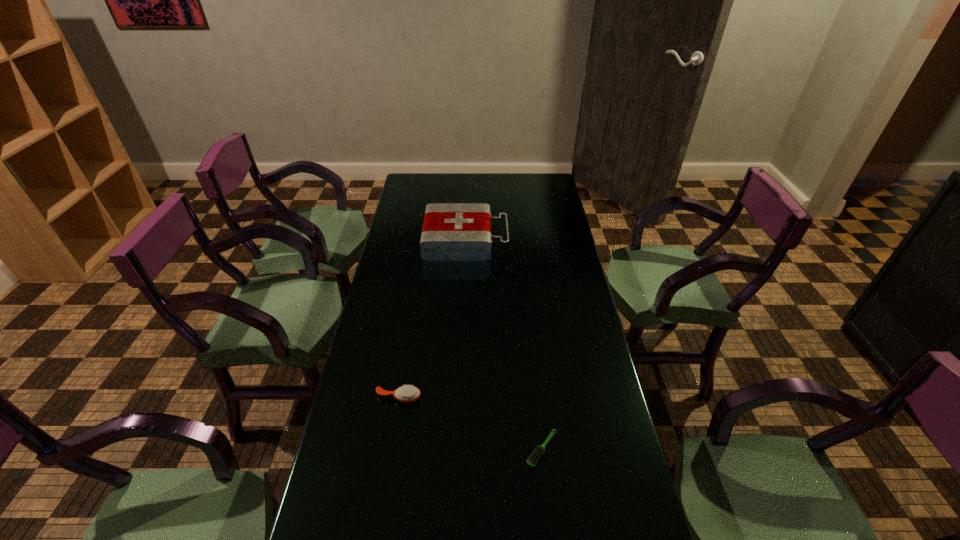
Identify the location of vacant point located between the farthest object and the nearest object. The height and width of the screenshot is (540, 960). point(504,345).

Identify the location of vacant area that lies between the tallest object and the second shortest object. The image size is (960, 540). (432, 319).

Where is `vacant region between the tallest object and the farther hairbrush`? This screenshot has width=960, height=540. vacant region between the tallest object and the farther hairbrush is located at coordinates (432, 319).

Where is `the closest object relative to the second shortest object`? the closest object relative to the second shortest object is located at coordinates (533, 458).

Choose which object is the second nearest neighbor to the nearest object. Please provide its 2D coordinates. Your answer should be formatted as a tuple, i.e. [(x, y)], where the tuple contains the x and y coordinates of a point satisfying the conditions above.

[(451, 231)]

I want to click on free space that satisfies the following two spatial constraints: 1. on the front side of the tallest object; 2. on the left side of the rightmost object, so click(457, 449).

Where is `free space in the image that satisfies the following two spatial constraints: 1. on the back side of the rightmost object; 2. on the front side of the tallest object`? Image resolution: width=960 pixels, height=540 pixels. free space in the image that satisfies the following two spatial constraints: 1. on the back side of the rightmost object; 2. on the front side of the tallest object is located at coordinates (518, 240).

I want to click on free point that satisfies the following two spatial constraints: 1. on the front side of the tallest object; 2. on the back side of the nearest object, so click(x=457, y=449).

Locate an element on the screen. free location that satisfies the following two spatial constraints: 1. on the front side of the right hairbrush; 2. on the left side of the second tallest object is located at coordinates (391, 449).

You are a GUI agent. You are given a task and a screenshot of the screen. Output one action in this format:
    pyautogui.click(x=<x>, y=<y>)
    Task: Click on the free region that satisfies the following two spatial constraints: 1. on the front side of the farthest object; 2. on the right side of the right hairbrush
    The image size is (960, 540).
    Given the screenshot: What is the action you would take?
    pyautogui.click(x=457, y=449)